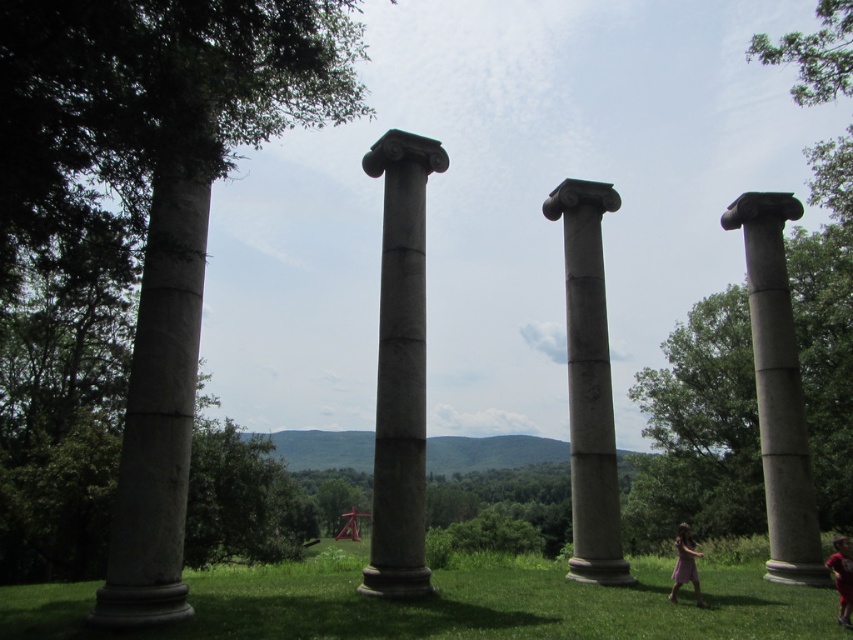
Question: Which point is closer to the camera?

Choices:
 (A) light brown wooden child at lower right
 (B) green grass at lower center
 (C) smooth gray column at left
 (D) gray stone column at center

Answer: (C)

Question: Which of the following is the farthest from the observer?

Choices:
 (A) gray stone column at center
 (B) purple cotton dress at lower right
 (C) light brown wooden child at lower right

Answer: (A)

Question: Observing the image, what is the correct spatial positioning of green grass at lower center in reference to gray stone column at right?

Choices:
 (A) below
 (B) above

Answer: (A)

Question: Does smooth gray column at left appear under gray stone column at right?

Choices:
 (A) yes
 (B) no

Answer: (A)

Question: Does gray stone column at center have a lesser width compared to purple cotton dress at lower right?

Choices:
 (A) no
 (B) yes

Answer: (B)

Question: Estimate the real-world distances between objects in this image. Which object is closer to the gray stone column at right?

Choices:
 (A) green grass at lower center
 (B) smooth gray column at left
 (C) light brown wooden child at lower right
 (D) gray stone column at center

Answer: (C)